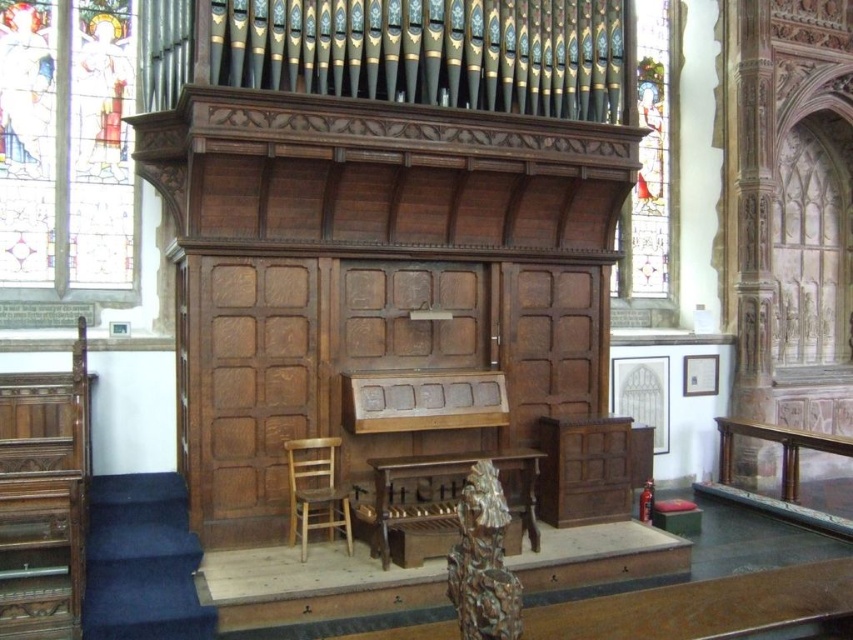
Does stained glass window at upper right appear on the right side of wooden altar at center?

Yes, stained glass window at upper right is to the right of wooden altar at center.

Is point (668, 32) positioned before point (531, 492)?

That is False.

Between point (641, 220) and point (376, 545), which one is positioned behind?

The point (641, 220) is more distant.

Find the location of a particular element. Image resolution: width=853 pixels, height=640 pixels. stained glass window at upper right is located at coordinates (648, 161).

Between point (62, 124) and point (664, 204), which one is positioned in front?

Point (62, 124) is more forward.

The image size is (853, 640). Identify the location of stained glass window at upper left. (67, 145).

Which of these two, stained glass window at upper left or wooden chair at lower left, stands shorter?

Standing shorter between the two is wooden chair at lower left.

Is stained glass window at upper left thinner than wooden chair at lower left?

No, stained glass window at upper left is not thinner than wooden chair at lower left.

Identify the location of stained glass window at upper left. (67, 145).

The image size is (853, 640). Find the location of `stained glass window at upper left`. stained glass window at upper left is located at coordinates (67, 145).